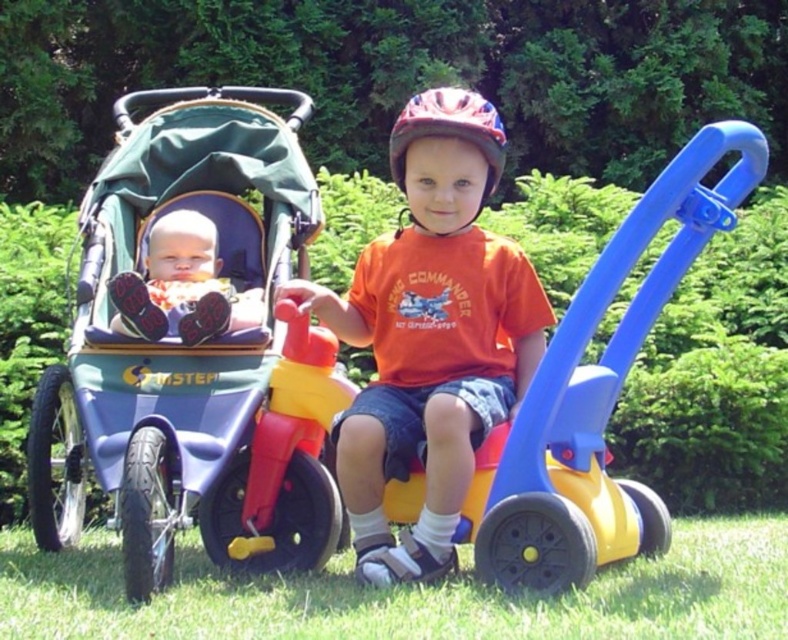
Question: Which object appears closest to the camera in this image?

Choices:
 (A) green grass at lower center
 (B) matte black shoes at center
 (C) matte red bicycle helmet at center
 (D) green fabric stroller at left

Answer: (A)

Question: Is green grass at lower center positioned before matte black shoes at center?

Choices:
 (A) yes
 (B) no

Answer: (A)

Question: Among these objects, which one is nearest to the camera?

Choices:
 (A) green fabric stroller at left
 (B) matte black shoes at center
 (C) green grass at lower center
 (D) matte red bicycle helmet at center

Answer: (C)

Question: Considering the relative positions of green fabric stroller at left and matte red bicycle helmet at center in the image provided, where is green fabric stroller at left located with respect to matte red bicycle helmet at center?

Choices:
 (A) below
 (B) above

Answer: (A)

Question: Does green fabric stroller at left have a lesser width compared to matte black shoes at center?

Choices:
 (A) no
 (B) yes

Answer: (A)

Question: Which point is closer to the camera?

Choices:
 (A) matte black shoes at center
 (B) matte red bicycle helmet at center
 (C) green fabric stroller at left
 (D) green grass at lower center

Answer: (D)